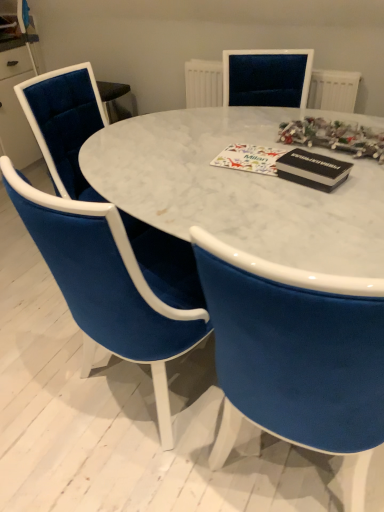
Where is `free spot to the left of velvet blue chair at center, which ranks as the 1th chair in front-to-back order`? This screenshot has height=512, width=384. free spot to the left of velvet blue chair at center, which ranks as the 1th chair in front-to-back order is located at coordinates (31, 376).